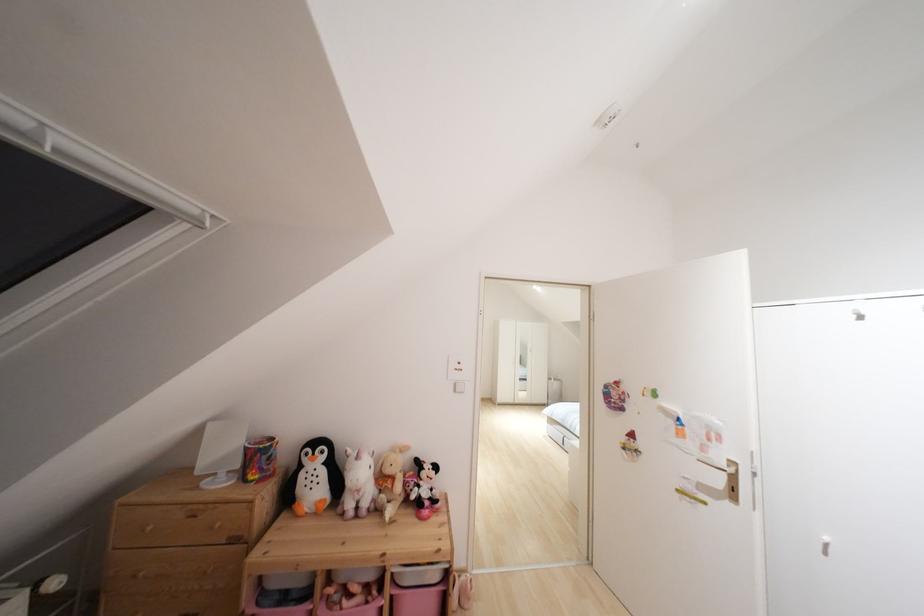
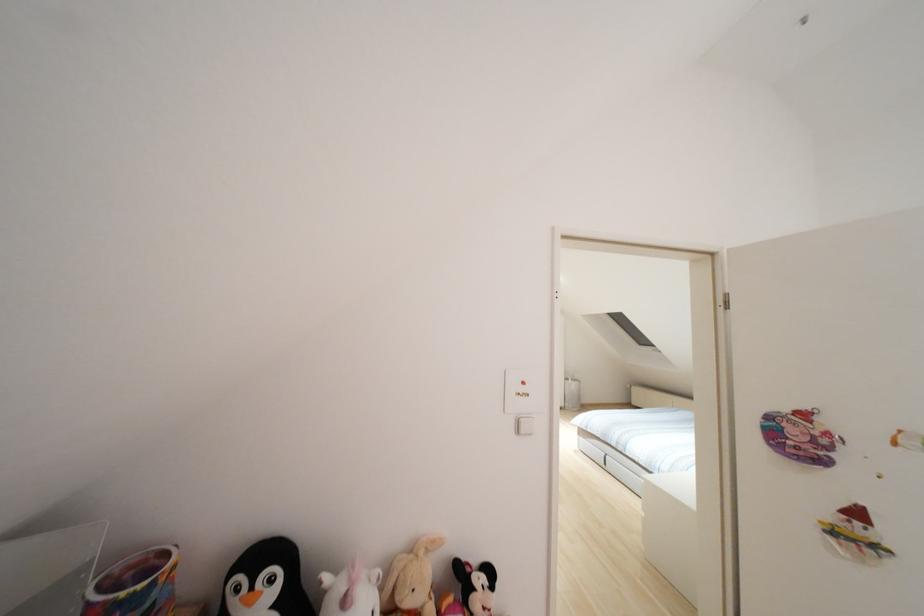
In the second image, find the point that corresponds to (386,469) in the first image.

(407, 601)